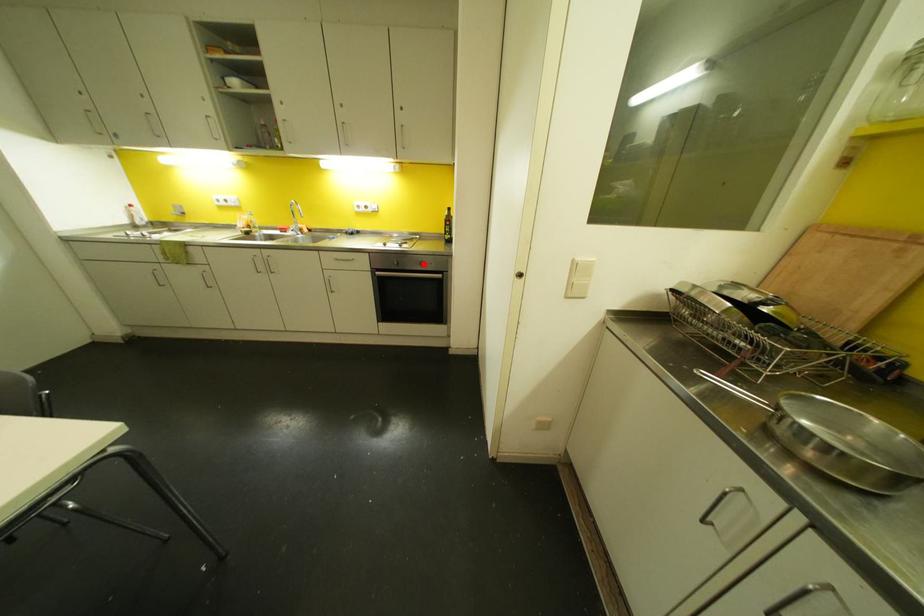
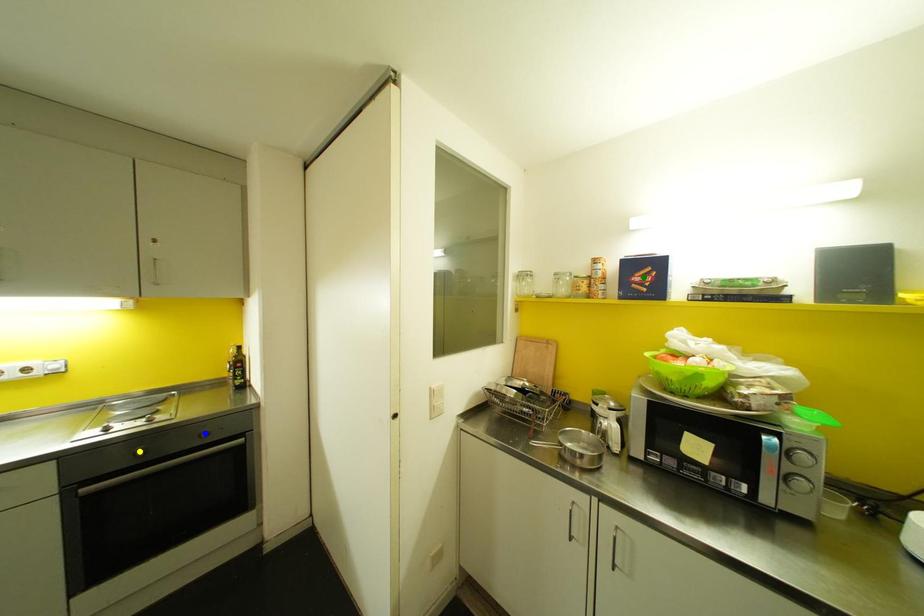
Question: I am providing you with two images of the same scene from different viewpoints. A red point is marked on the first image. You are given multiple points on the second image. Which point in image 2 is actually the same real-world point as the red point in image 1?

Choices:
 (A) yellow point
 (B) blue point
 (C) green point

Answer: (B)